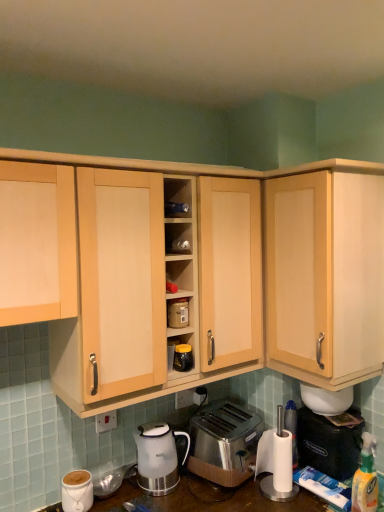
Question: Is white plastic electric outlet at center, which ranks as the 1th electric outlet in right-to-left order, closer to camera compared to stainless steel toaster at lower center?

Choices:
 (A) no
 (B) yes

Answer: (A)

Question: Is white plastic electric outlet at center, which ranks as the 1th electric outlet in right-to-left order, turned away from stainless steel toaster at lower center?

Choices:
 (A) no
 (B) yes

Answer: (A)

Question: Considering the relative sizes of white plastic electric outlet at center, which ranks as the 1th electric outlet in right-to-left order, and stainless steel toaster at lower center in the image provided, is white plastic electric outlet at center, which ranks as the 1th electric outlet in right-to-left order, wider than stainless steel toaster at lower center?

Choices:
 (A) yes
 (B) no

Answer: (B)

Question: Can you confirm if white plastic electric outlet at center, which ranks as the 1th electric outlet in right-to-left order, is thinner than stainless steel toaster at lower center?

Choices:
 (A) yes
 (B) no

Answer: (A)

Question: Is white plastic electric outlet at center, positioned as the second electric outlet in front-to-back order, smaller than stainless steel toaster at lower center?

Choices:
 (A) yes
 (B) no

Answer: (A)

Question: Could you tell me if white plastic electric outlet at center, positioned as the second electric outlet in front-to-back order, is turned towards stainless steel toaster at lower center?

Choices:
 (A) yes
 (B) no

Answer: (B)

Question: Does matte white coffee cup at lower left lie behind matte plastic container at center?

Choices:
 (A) no
 (B) yes

Answer: (A)

Question: Is matte white coffee cup at lower left closer to camera compared to matte plastic container at center?

Choices:
 (A) no
 (B) yes

Answer: (B)

Question: Is matte white coffee cup at lower left facing towards matte plastic container at center?

Choices:
 (A) yes
 (B) no

Answer: (B)

Question: Does matte white coffee cup at lower left have a larger size compared to matte plastic container at center?

Choices:
 (A) yes
 (B) no

Answer: (A)

Question: Is matte white coffee cup at lower left positioned beyond the bounds of matte plastic container at center?

Choices:
 (A) no
 (B) yes

Answer: (B)

Question: From a real-world perspective, is matte white coffee cup at lower left below matte plastic container at center?

Choices:
 (A) no
 (B) yes

Answer: (B)

Question: Does white plastic electric outlet at lower center, marked as the second electric outlet in a back-to-front arrangement, appear on the left side of matte white coffee cup at lower left?

Choices:
 (A) no
 (B) yes

Answer: (A)